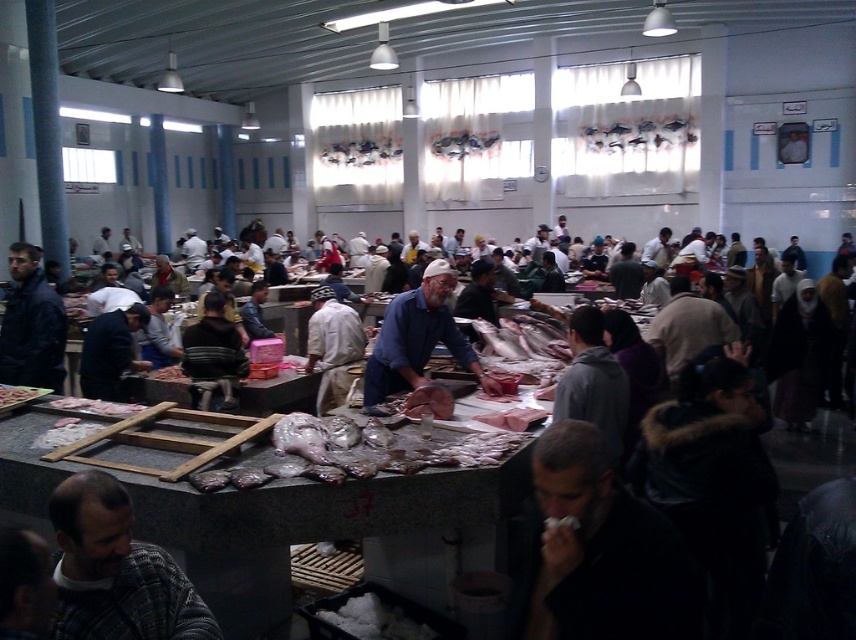
Question: Among these points, which one is nearest to the camera?

Choices:
 (A) click(3, 387)
 (B) click(64, 372)

Answer: (A)

Question: Among these points, which one is nearest to the camera?

Choices:
 (A) (33, 396)
 (B) (325, 307)

Answer: (A)

Question: Estimate the real-world distances between objects in this image. Which object is farther from the dark matte jacket at lower right?

Choices:
 (A) dark gray sweater at lower left
 (B) dark blue jacket at center
 (C) blue fabric at center

Answer: (B)

Question: Considering the relative positions of dark matte jacket at lower right and dark blue jacket at center in the image provided, where is dark matte jacket at lower right located with respect to dark blue jacket at center?

Choices:
 (A) above
 (B) below

Answer: (B)

Question: Does blue fabric at center have a smaller size compared to shiny silver fish at center?

Choices:
 (A) no
 (B) yes

Answer: (A)

Question: Does dark matte jacket at lower right come in front of white fabric at center?

Choices:
 (A) yes
 (B) no

Answer: (A)